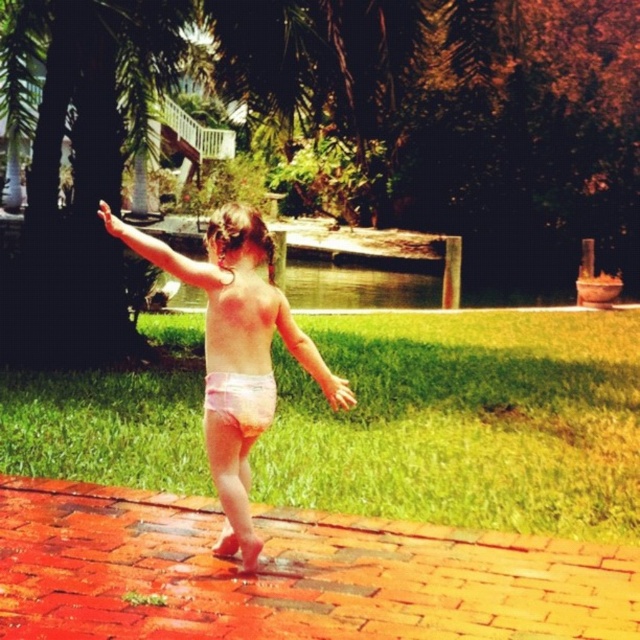
Can you confirm if pink cloth diaper at center is positioned to the left of pink fabric diaper at center?

Indeed, pink cloth diaper at center is positioned on the left side of pink fabric diaper at center.

Who is lower down, pink cloth diaper at center or pink fabric diaper at center?

pink fabric diaper at center

Is point (102, 211) in front of point (221, 397)?

No, it is not.

This screenshot has height=640, width=640. What are the coordinates of `pink cloth diaper at center` in the screenshot? It's located at (236, 304).